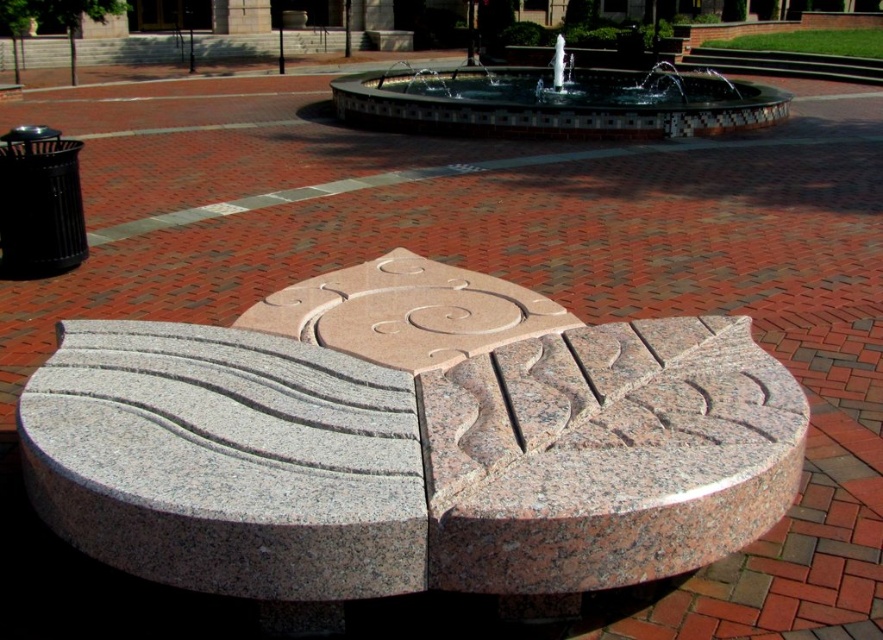
You are standing at the entrance of the plaza and want to find the granite sculpture at center. According to the plaza layout, where should you look relative to the fountain?

The granite sculpture at center is located at coordinates point (409,442), so it is positioned to the right and slightly above the fountain.

You are standing in the plaza and want to take a photo of the granite sculpture at center and the polished mosaic water at upper center. Which object should you focus on first if you want to capture both in the same frame without moving your camera?

The granite sculpture at center is below the polished mosaic water at upper center, so you should focus on the polished mosaic water at upper center first to ensure both are in the frame.